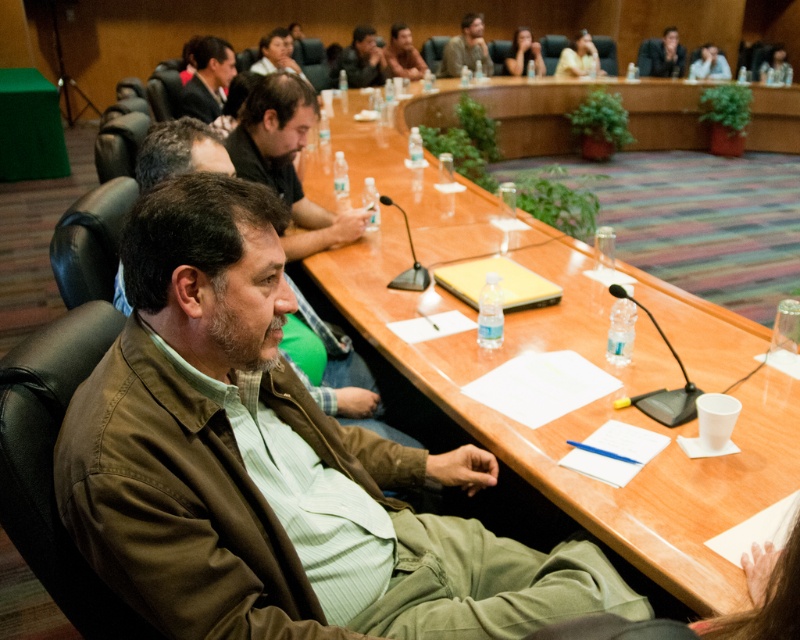
Between matte black suit at upper left and matte black laptop at upper right, which one is positioned lower?

Positioned lower is matte black suit at upper left.

Is point (202, 115) less distant than point (722, 74)?

Yes, it is.

Does point (202, 40) lie behind point (708, 60)?

That is False.

Where is `matte black suit at upper left`? The image size is (800, 640). matte black suit at upper left is located at coordinates (208, 77).

Looking at this image, does brown leather jacket at center have a lesser height compared to matte black hair at upper center?

Yes.

Between point (294, 257) and point (514, 54), which one is positioned behind?

The point (514, 54) is more distant.

This screenshot has height=640, width=800. Describe the element at coordinates (288, 161) in the screenshot. I see `brown leather jacket at center` at that location.

You are a GUI agent. You are given a task and a screenshot of the screen. Output one action in this format:
    pyautogui.click(x=<x>, y=<y>)
    Task: Click on the brown leather jacket at center
    The height and width of the screenshot is (640, 800).
    Given the screenshot: What is the action you would take?
    pyautogui.click(x=288, y=161)

Does light beige shirt at upper center have a lesser height compared to matte black laptop at upper right?

In fact, light beige shirt at upper center may be taller than matte black laptop at upper right.

Is light beige shirt at upper center to the right of matte black laptop at upper right from the viewer's perspective?

No, light beige shirt at upper center is not to the right of matte black laptop at upper right.

Find the location of a particular element. The image size is (800, 640). light beige shirt at upper center is located at coordinates (578, 58).

Identify the location of light beige shirt at upper center. The width and height of the screenshot is (800, 640). (578, 58).